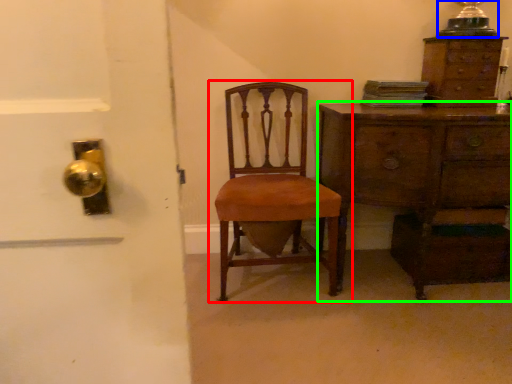
Question: Considering the real-world distances, which object is closest to chair (highlighted by a red box)? table lamp (highlighted by a blue box) or chest of drawers (highlighted by a green box).

Choices:
 (A) table lamp
 (B) chest of drawers

Answer: (B)